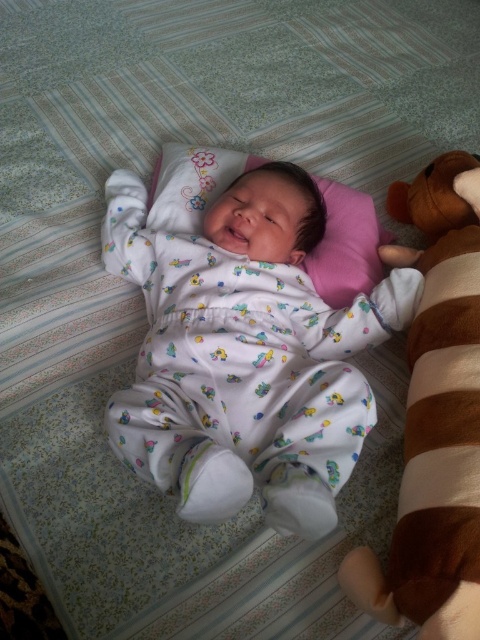
What is the exact position of the white cotton onesie at center in the image?

The white cotton onesie at center is located at point (244, 353).

You are a parent looking at the baby in the image. You want to place a new toy between the white cotton onesie at center and the brown plush bear at right. Where should you place the new toy?

The new toy should be placed between the white cotton onesie at center and the brown plush bear at right, as the onesie is to the left of the bear.